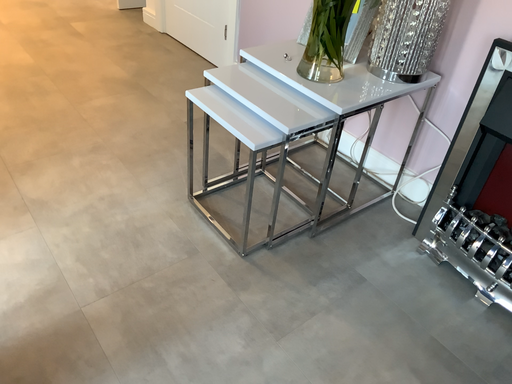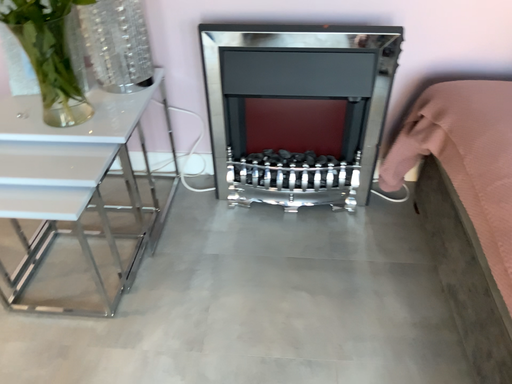
Question: Which way did the camera rotate in the video?

Choices:
 (A) rotated right
 (B) rotated left

Answer: (A)